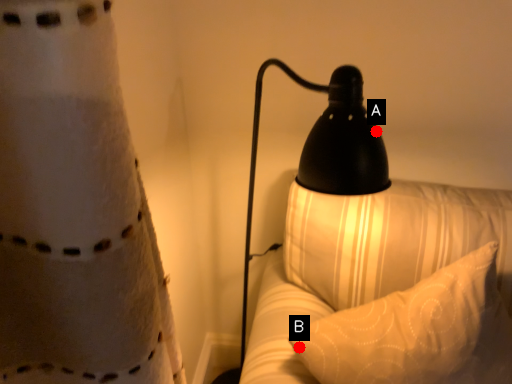
Question: Two points are circled on the image, labeled by A and B beside each circle. Which point is farther to the camera?

Choices:
 (A) A is further
 (B) B is further

Answer: (B)